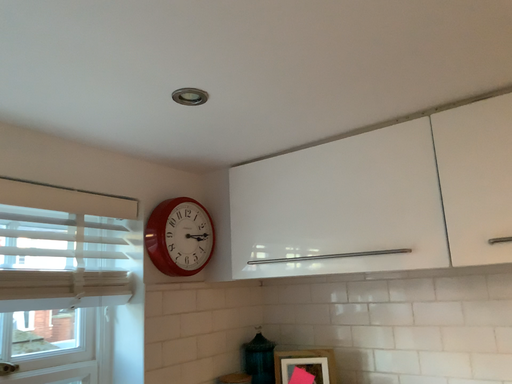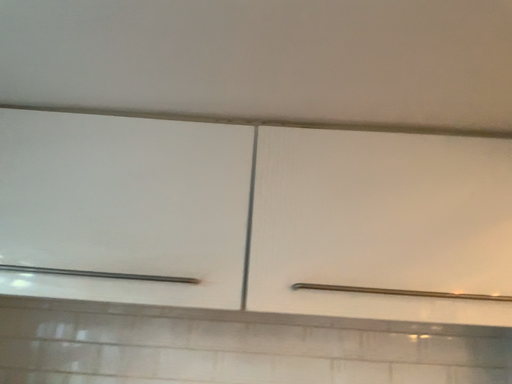
Question: How did the camera likely rotate when shooting the video?

Choices:
 (A) rotated right
 (B) rotated left

Answer: (A)